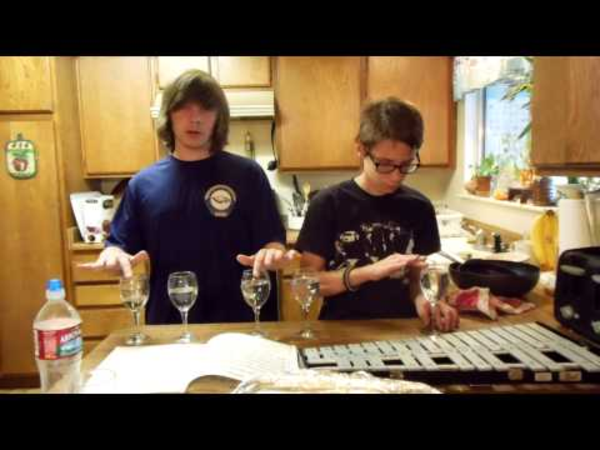
Locate an element on the screen. The image size is (600, 450). bottle is located at coordinates (54, 315).